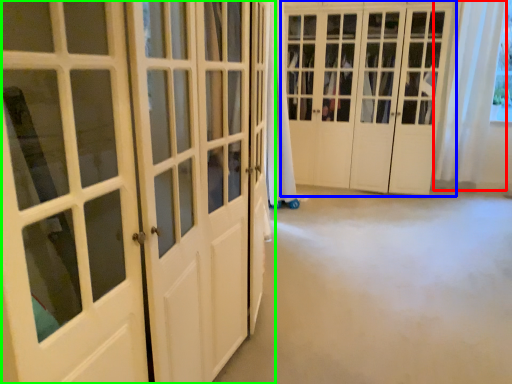
Question: Which object is the farthest from curtain (highlighted by a red box)? Choose among these: door (highlighted by a blue box) or door (highlighted by a green box).

Choices:
 (A) door
 (B) door

Answer: (B)